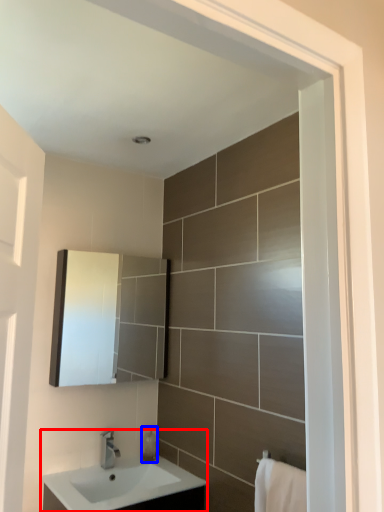
Question: Which object is further to the camera taking this photo, sink (highlighted by a red box) or soap dispenser (highlighted by a blue box)?

Choices:
 (A) sink
 (B) soap dispenser

Answer: (B)